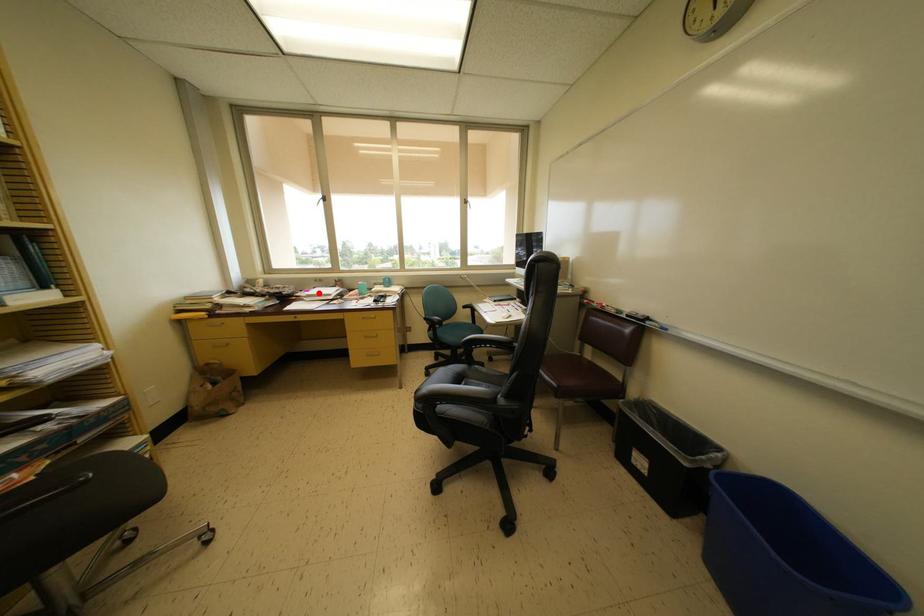
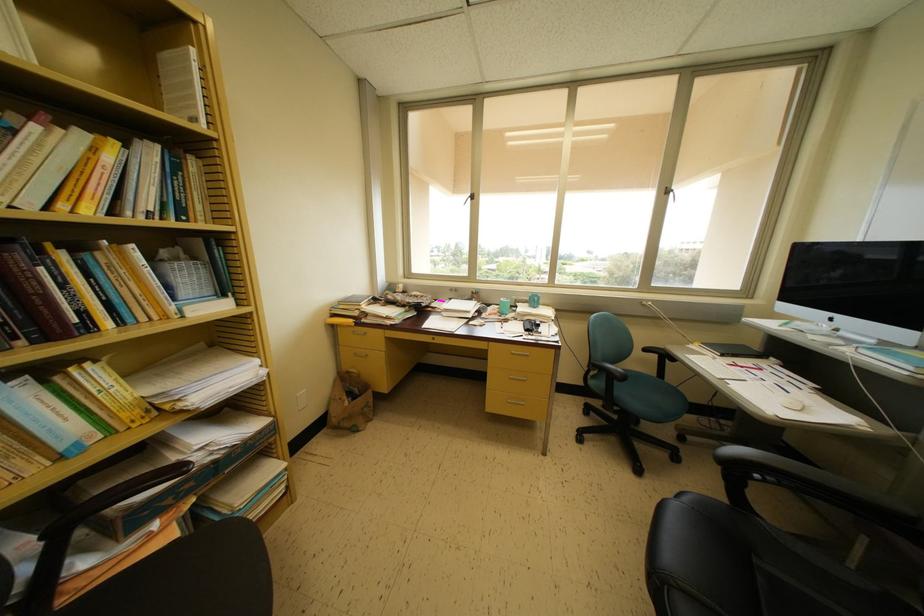
The point at the highlighted location is marked in the first image. Where is the corresponding point in the second image?

(455, 304)